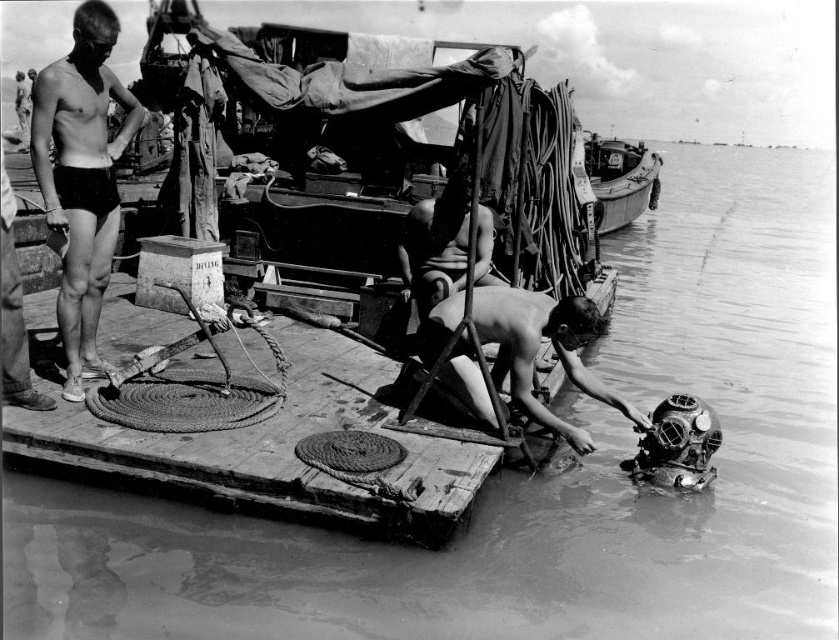
Which is more to the left, smooth skin diver at lower center or smooth skin man at center?

Positioned to the left is smooth skin man at center.

Does point (608, 401) come in front of point (444, 275)?

Yes.

Does point (555, 339) lie in front of point (447, 292)?

Yes, point (555, 339) is in front of point (447, 292).

The image size is (839, 640). In order to click on smooth skin diver at lower center in this screenshot , I will do `click(519, 352)`.

Does wooden dock at lower center have a greater width compared to black matte shorts at left?

Yes.

Is wooden dock at lower center below black matte shorts at left?

Yes.

This screenshot has width=839, height=640. Find the location of `wooden dock at lower center`. wooden dock at lower center is located at coordinates (279, 448).

What are the coordinates of `wooden dock at lower center` in the screenshot? It's located at 279,448.

Is the position of black matte shorts at left less distant than that of wooden boat at upper right?

Yes, black matte shorts at left is in front of wooden boat at upper right.

Which of these two, black matte shorts at left or wooden boat at upper right, stands taller?

Standing taller between the two is wooden boat at upper right.

Find the location of a particular element. black matte shorts at left is located at coordinates (81, 179).